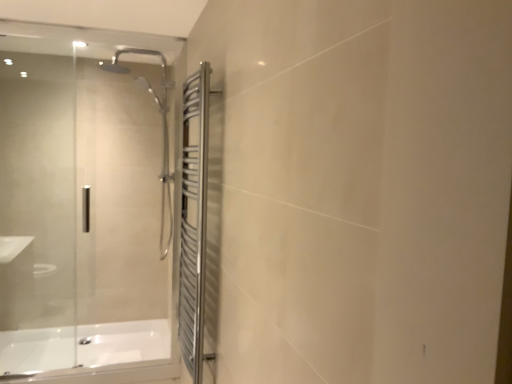
Question: In the image, is white glossy bathtub at lower left on the left side or the right side of polished stainless steel towel rack at right?

Choices:
 (A) left
 (B) right

Answer: (A)

Question: In terms of width, does white glossy bathtub at lower left look wider or thinner when compared to polished stainless steel towel rack at right?

Choices:
 (A) thin
 (B) wide

Answer: (B)

Question: Estimate the real-world distances between objects in this image. Which object is farther from the white glossy bathtub at lower left?

Choices:
 (A) polished stainless steel towel rack at right
 (B) transparent glass door at left

Answer: (A)

Question: Which is nearer to the polished stainless steel towel rack at right?

Choices:
 (A) white glossy bathtub at lower left
 (B) transparent glass door at left

Answer: (A)